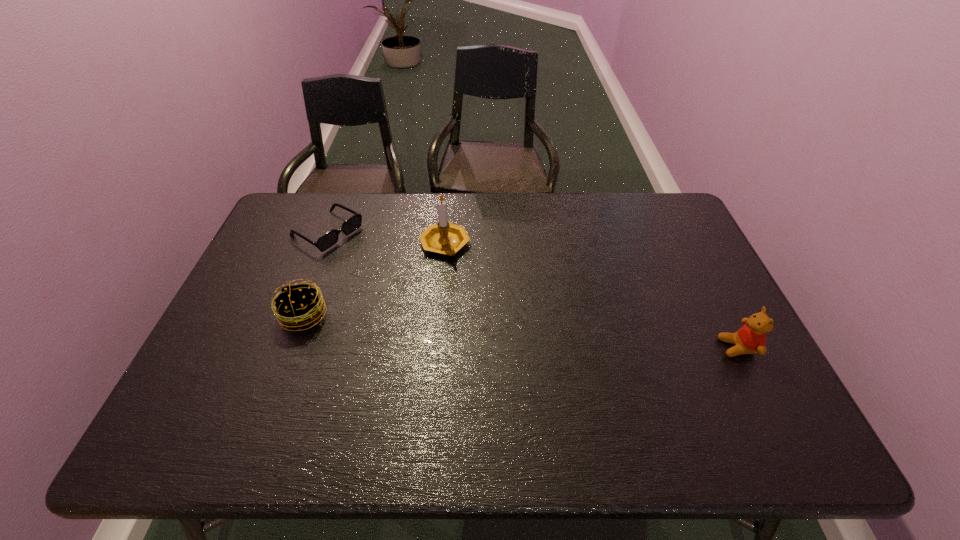
Identify the location of empty space that is in between the second tallest object and the second shortest object. (520, 332).

Find the location of `empty space between the shortest object and the second tallest object`. empty space between the shortest object and the second tallest object is located at coordinates (532, 290).

Identify the location of blank region between the shortest object and the rightmost object. (532, 290).

Locate an element on the screen. Image resolution: width=960 pixels, height=540 pixels. empty space that is in between the tallest object and the shortest object is located at coordinates (386, 239).

You are a GUI agent. You are given a task and a screenshot of the screen. Output one action in this format:
    pyautogui.click(x=<x>, y=<y>)
    Task: Click on the vacant area that lies between the sunglasses and the candle holder
    The image size is (960, 540).
    Given the screenshot: What is the action you would take?
    pyautogui.click(x=386, y=239)

Identify the location of empty location between the teddy bear and the candle holder. The image size is (960, 540). (591, 296).

Locate an element on the screen. The image size is (960, 540). vacant region between the rightmost object and the second object from right to left is located at coordinates [591, 296].

Locate an element on the screen. This screenshot has height=540, width=960. vacant area that lies between the second object from right to left and the patty is located at coordinates (374, 280).

Identify which object is located as the third nearest to the patty. Please provide its 2D coordinates. Your answer should be formatted as a tuple, i.e. [(x, y)], where the tuple contains the x and y coordinates of a point satisfying the conditions above.

[(751, 338)]

You are a GUI agent. You are given a task and a screenshot of the screen. Output one action in this format:
    pyautogui.click(x=<x>, y=<y>)
    Task: Click on the closest object to the teddy bear
    The image size is (960, 540).
    Given the screenshot: What is the action you would take?
    pyautogui.click(x=446, y=238)